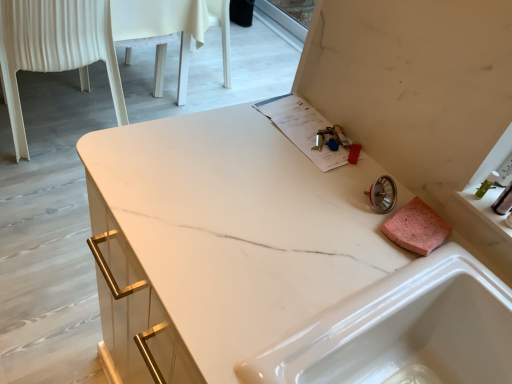
Question: Is white glossy sink at lower right further to camera compared to translucent plastic container at right?

Choices:
 (A) yes
 (B) no

Answer: (B)

Question: From a real-world perspective, is white glossy sink at lower right located beneath translucent plastic container at right?

Choices:
 (A) no
 (B) yes

Answer: (B)

Question: Is white glossy sink at lower right outside translucent plastic container at right?

Choices:
 (A) yes
 (B) no

Answer: (A)

Question: Is white glossy sink at lower right directly adjacent to translucent plastic container at right?

Choices:
 (A) no
 (B) yes

Answer: (A)

Question: Are white glossy sink at lower right and translucent plastic container at right far apart?

Choices:
 (A) no
 (B) yes

Answer: (A)

Question: Is white glossy sink at lower right to the left of translucent plastic container at right from the viewer's perspective?

Choices:
 (A) yes
 (B) no

Answer: (A)

Question: From a real-world perspective, is translucent plastic container at right beneath white glossy sink at lower right?

Choices:
 (A) no
 (B) yes

Answer: (A)

Question: Does translucent plastic container at right have a greater width compared to white glossy sink at lower right?

Choices:
 (A) no
 (B) yes

Answer: (A)

Question: Is white glossy sink at lower right at the back of translucent plastic container at right?

Choices:
 (A) no
 (B) yes

Answer: (A)

Question: Could you tell me if translucent plastic container at right is facing white glossy sink at lower right?

Choices:
 (A) no
 (B) yes

Answer: (A)

Question: Is translucent plastic container at right further to camera compared to white glossy sink at lower right?

Choices:
 (A) no
 (B) yes

Answer: (B)

Question: Is translucent plastic container at right next to white glossy sink at lower right and touching it?

Choices:
 (A) no
 (B) yes

Answer: (A)

Question: Could you tell me if translucent plastic container at right is turned towards white plastic chair at left?

Choices:
 (A) yes
 (B) no

Answer: (B)